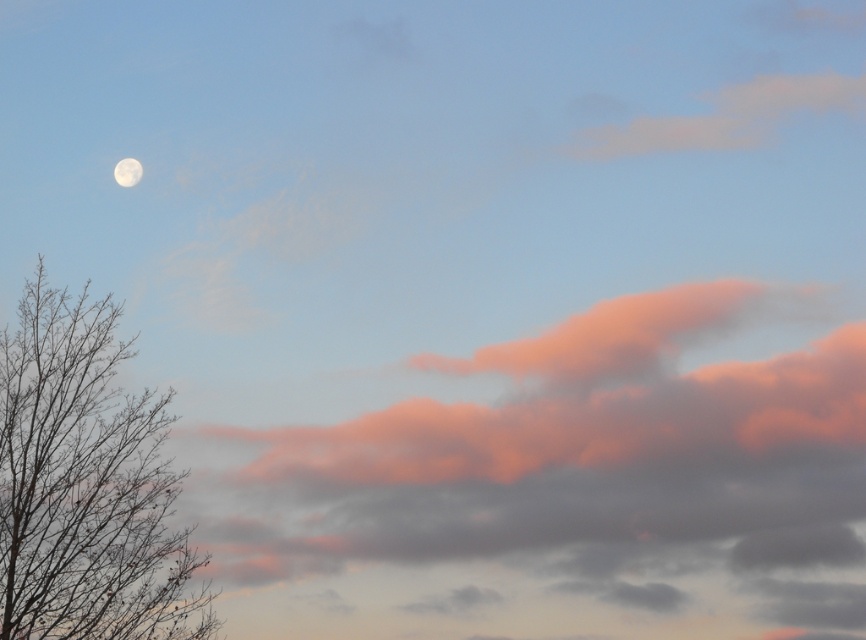
How far apart are bare branches at left and white fluffy cloud at upper left?

bare branches at left is 9.98 feet from white fluffy cloud at upper left.

Between bare branches at left and white fluffy cloud at upper left, which one has less height?

With less height is white fluffy cloud at upper left.

At what (x,y) coordinates should I click in order to perform the action: click on bare branches at left. Please return your answer as a coordinate pair (x, y). Image resolution: width=866 pixels, height=640 pixels. Looking at the image, I should click on (86, 484).